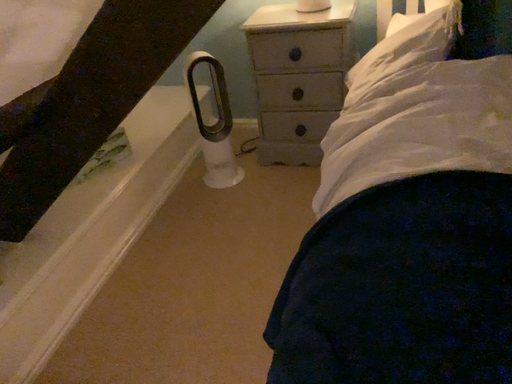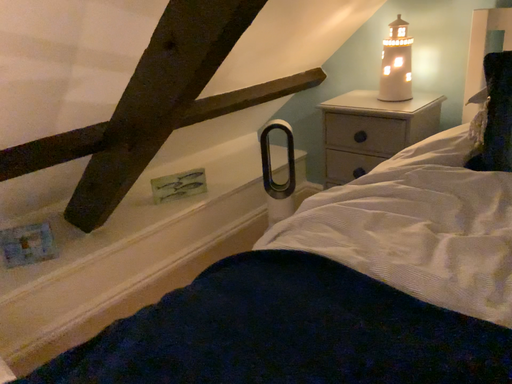
Question: Which way did the camera rotate in the video?

Choices:
 (A) rotated left
 (B) rotated right

Answer: (A)